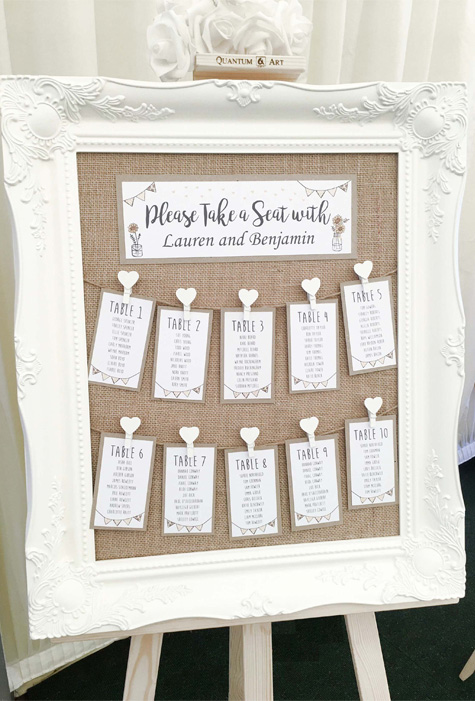
The height and width of the screenshot is (701, 475). Identify the location of curtain. (444, 53), (421, 55), (394, 33), (354, 34), (329, 50), (137, 50), (70, 41).